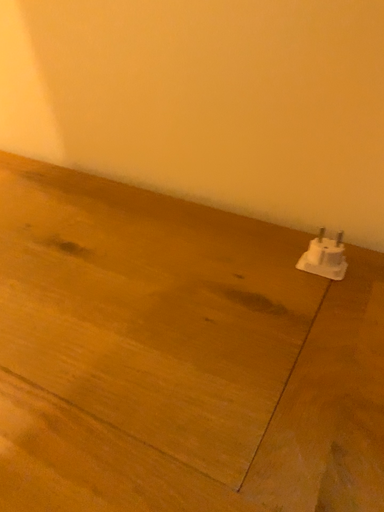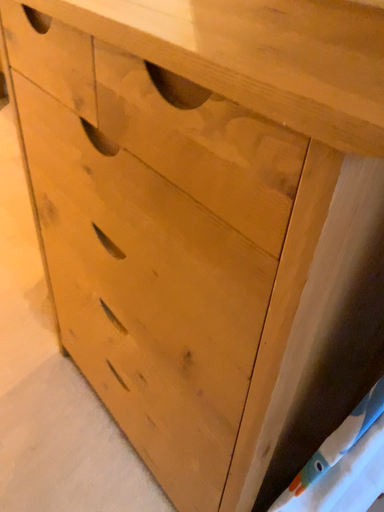
Question: Which way did the camera rotate in the video?

Choices:
 (A) rotated right
 (B) rotated left

Answer: (B)